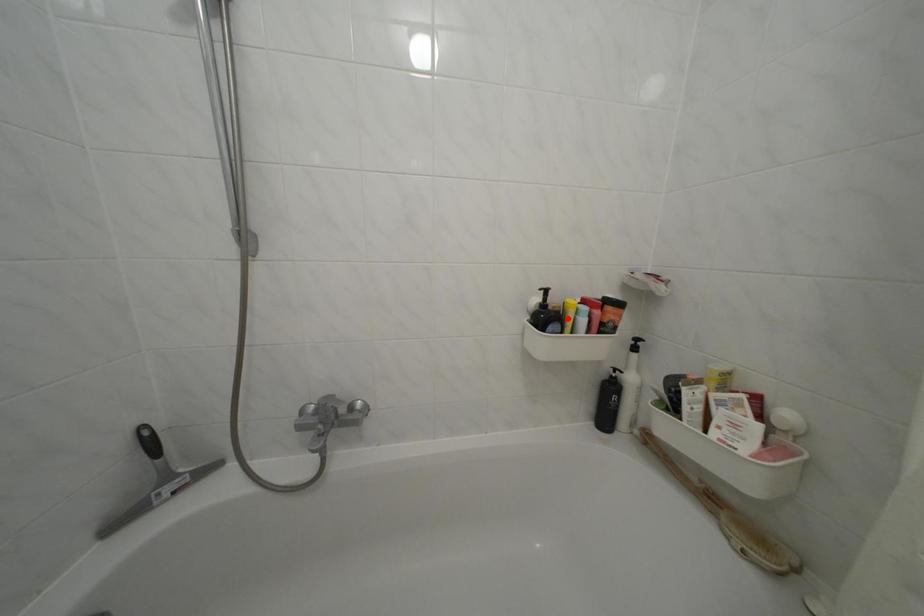
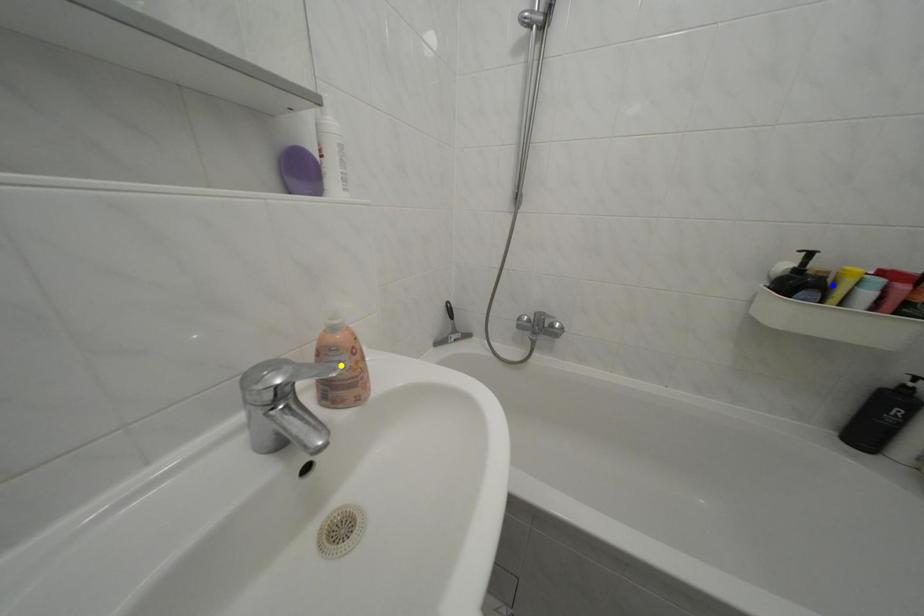
Question: I am providing you with two images of the same scene from different viewpoints. A red point is marked on the first image. You are given multiple points on the second image. Which mark in image 2 goes with the point in image 1?

Choices:
 (A) green point
 (B) blue point
 (C) yellow point

Answer: (B)